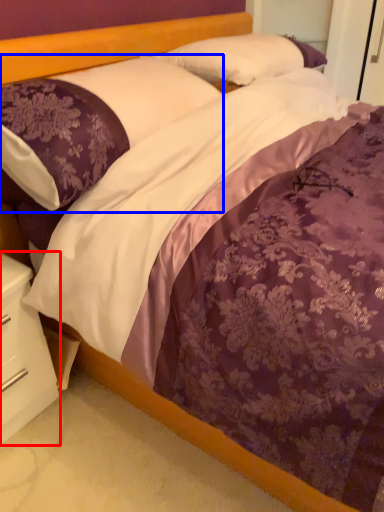
Question: Which object appears closest to the camera in this image, nightstand (highlighted by a red box) or pillow (highlighted by a blue box)?

Choices:
 (A) nightstand
 (B) pillow

Answer: (B)